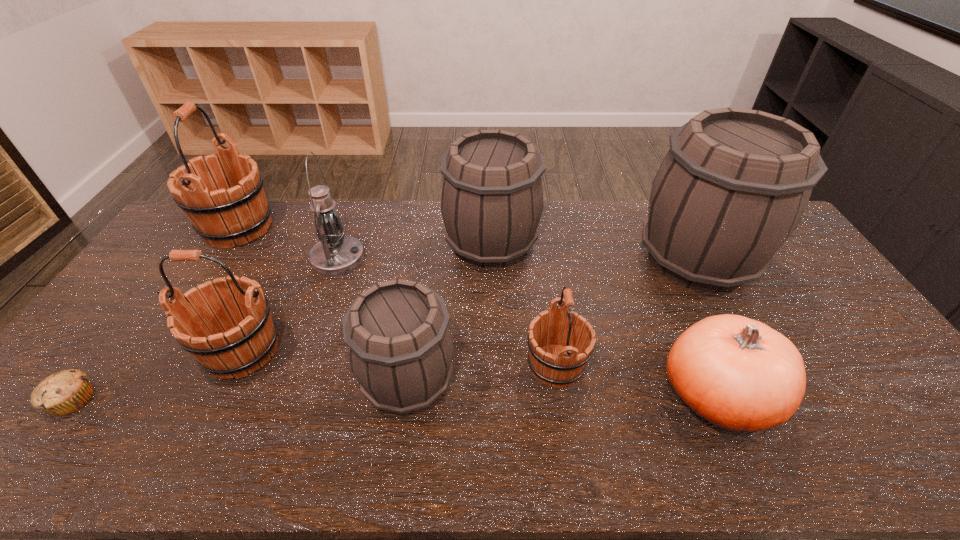
Image resolution: width=960 pixels, height=540 pixels. What are the coordinates of `vacant space situated 0.380m on the right of the farthest wood wine bucket` in the screenshot? It's located at (382, 228).

Where is `vacant space located on the front of the rightmost brown wine bucket`? The height and width of the screenshot is (540, 960). vacant space located on the front of the rightmost brown wine bucket is located at coordinates (730, 320).

Where is `free space located 0.370m on the right of the oil lamp`? The height and width of the screenshot is (540, 960). free space located 0.370m on the right of the oil lamp is located at coordinates (475, 259).

Where is `free space located 0.280m on the front of the second biggest brown wine bucket`? Image resolution: width=960 pixels, height=540 pixels. free space located 0.280m on the front of the second biggest brown wine bucket is located at coordinates (493, 347).

This screenshot has width=960, height=540. Identify the location of free location located on the front of the second smallest wood wine bucket. (214, 411).

Find the location of a particular element. The width and height of the screenshot is (960, 540). free space located on the left of the rightmost wood wine bucket is located at coordinates (465, 366).

The width and height of the screenshot is (960, 540). What are the coordinates of `free location located 0.370m on the right of the nearest brown wine bucket` in the screenshot? It's located at (600, 380).

Identify the location of vacant space situated 0.130m on the left of the pumpkin. (609, 395).

The image size is (960, 540). I want to click on free space located on the right of the shortest object, so click(x=152, y=400).

Locate an element on the screen. This screenshot has width=960, height=540. object at the near edge is located at coordinates (739, 374).